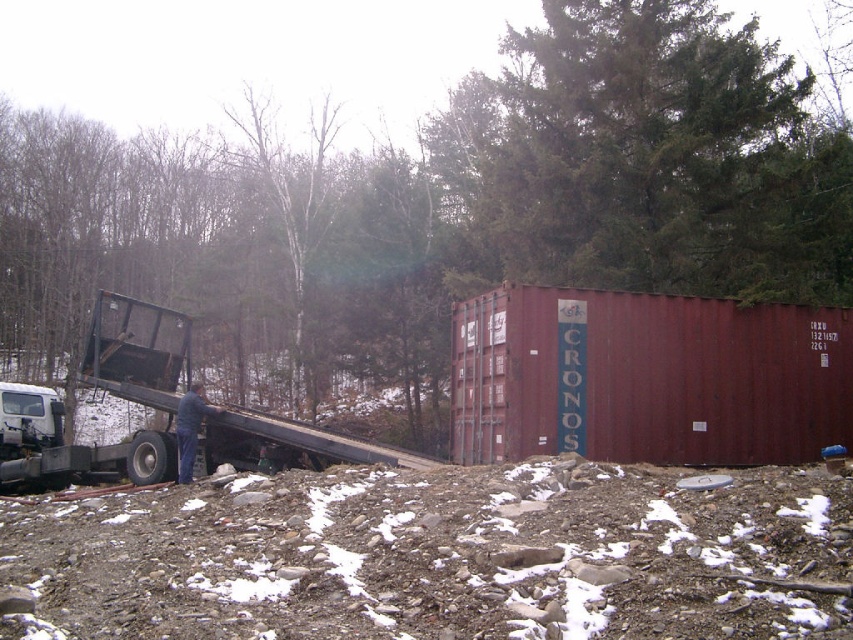
You are standing in front of the large red shipping container labeled CRONOS and want to place a small marker at the two points labeled point (x=569, y=452) and point (x=836, y=380). Which point should you place the marker closer to the camera?

Point (x=569, y=452) is closer to the camera than point (x=836, y=380), so you should place the marker closer to point (x=569, y=452).

You are a delivery driver who needs to park your truck with a bed width of 2 meters in this scene. The truck must be parked so that its bed aligns with the existing metallic flatbed truck at left. Can your truck fit in the space between the metallic truck bed at center and the large red shipping container on the right?

The metallic truck bed at center might be wider than metallic flatbed truck at left. Since your truck has a bed width of 2 meters, it is uncertain if it can fit between the existing metallic truck bed at center and the shipping container. You should measure the available space before deciding to park there.